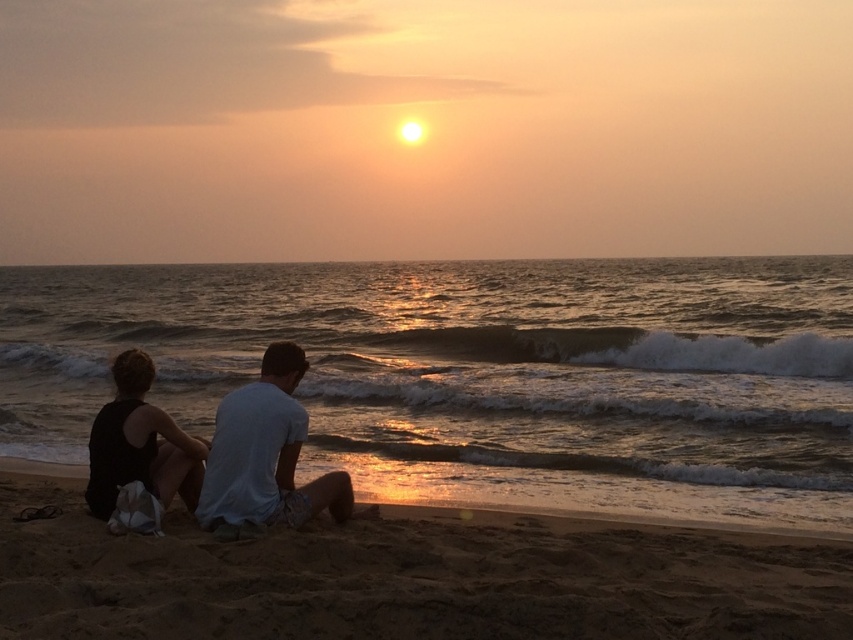
Question: Which point is farther from the camera taking this photo?

Choices:
 (A) (242, 484)
 (B) (152, 492)

Answer: (B)

Question: Is fine-grained sand at lower center above black fabric dress at lower left?

Choices:
 (A) no
 (B) yes

Answer: (A)

Question: Which object is closer to the camera taking this photo?

Choices:
 (A) fine-grained sand at lower center
 (B) black fabric dress at lower left

Answer: (A)

Question: Estimate the real-world distances between objects in this image. Which object is farther from the white cotton shirt at center?

Choices:
 (A) black fabric dress at lower left
 (B) fine-grained sand at lower center

Answer: (B)

Question: Can you confirm if fine-grained sand at lower center is positioned to the right of white cotton shirt at center?

Choices:
 (A) no
 (B) yes

Answer: (B)

Question: In this image, where is fine-grained sand at lower center located relative to white cotton shirt at center?

Choices:
 (A) above
 (B) below

Answer: (B)